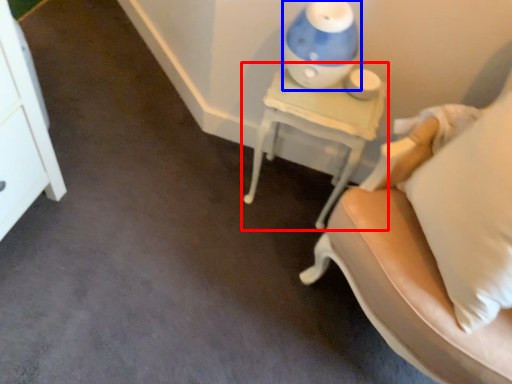
Question: Among these objects, which one is nearest to the camera, nightstand (highlighted by a red box) or table lamp (highlighted by a blue box)?

Choices:
 (A) nightstand
 (B) table lamp

Answer: (B)